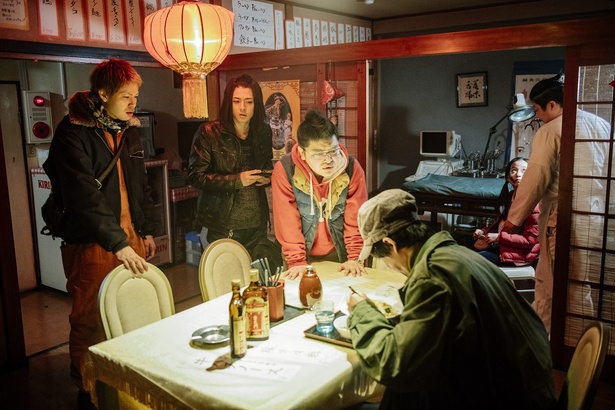
Locate an element on the screen. table cloth is located at coordinates (171, 345).